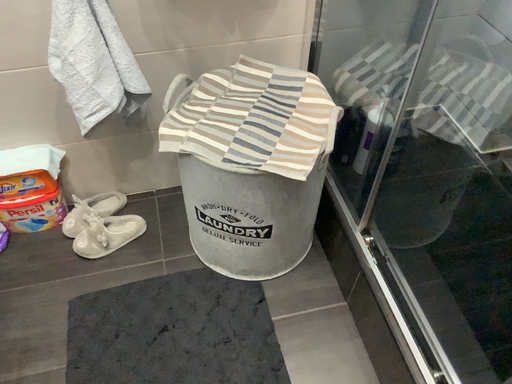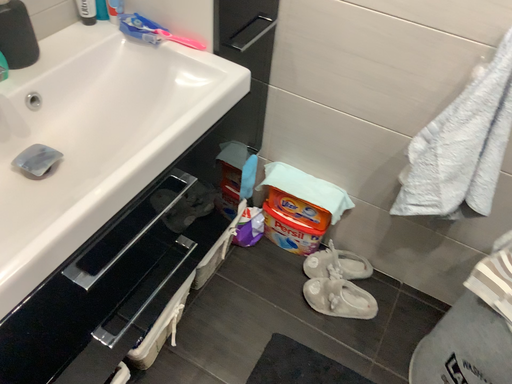
Question: Which way did the camera rotate in the video?

Choices:
 (A) rotated right
 (B) rotated left

Answer: (B)